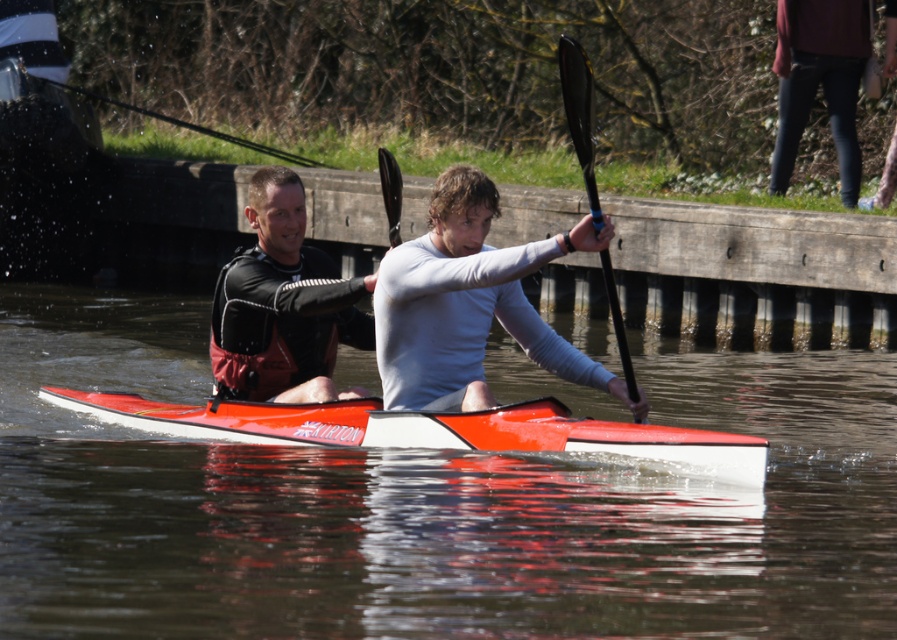
Is black neoprene wetsuit at left to the left of black rubber paddle at center from the viewer's perspective?

Yes, black neoprene wetsuit at left is to the left of black rubber paddle at center.

Who is higher up, black neoprene wetsuit at left or black rubber paddle at center?

black rubber paddle at center

Is point (329, 346) positioned before point (395, 243)?

That is False.

Find the location of a particular element. black neoprene wetsuit at left is located at coordinates (283, 305).

Who is positioned more to the left, transparent water at center or shiny orange kayak at center?

Positioned to the left is transparent water at center.

Image resolution: width=897 pixels, height=640 pixels. What do you see at coordinates (430, 506) in the screenshot?
I see `transparent water at center` at bounding box center [430, 506].

Between point (307, 490) and point (281, 438), which one is positioned behind?

Point (281, 438)

You are a GUI agent. You are given a task and a screenshot of the screen. Output one action in this format:
    pyautogui.click(x=<x>, y=<y>)
    Task: Click on the transparent water at center
    This screenshot has height=640, width=897.
    Given the screenshot: What is the action you would take?
    pyautogui.click(x=430, y=506)

Can you confirm if black rubber paddle at upper center is thinner than black rubber paddle at center?

Incorrect, black rubber paddle at upper center's width is not less than black rubber paddle at center's.

Between point (571, 76) and point (398, 193), which one is positioned in front?

Point (571, 76)

Does point (599, 228) come closer to viewer compared to point (379, 156)?

Yes, it is in front of point (379, 156).

Identify the location of black rubber paddle at upper center. (579, 115).